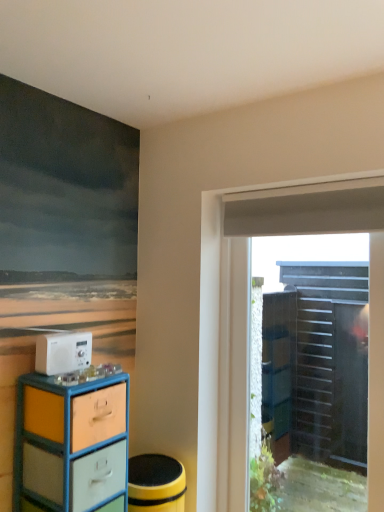
Question: Does white plastic radio at lower left have a larger size compared to matte plastic chest of drawers at left?

Choices:
 (A) no
 (B) yes

Answer: (A)

Question: Does white plastic radio at lower left have a smaller size compared to matte plastic chest of drawers at left?

Choices:
 (A) yes
 (B) no

Answer: (A)

Question: Is the surface of white plastic radio at lower left in direct contact with matte plastic chest of drawers at left?

Choices:
 (A) yes
 (B) no

Answer: (B)

Question: Does white plastic radio at lower left contain matte plastic chest of drawers at left?

Choices:
 (A) yes
 (B) no

Answer: (B)

Question: Is white plastic radio at lower left outside of matte plastic chest of drawers at left?

Choices:
 (A) yes
 (B) no

Answer: (A)

Question: Considering the positions of white plastic radio at lower left and transparent plastic door at right in the image, is white plastic radio at lower left wider or thinner than transparent plastic door at right?

Choices:
 (A) thin
 (B) wide

Answer: (A)

Question: From a real-world perspective, is white plastic radio at lower left positioned above or below transparent plastic door at right?

Choices:
 (A) above
 (B) below

Answer: (A)

Question: Looking at the image, does white plastic radio at lower left seem bigger or smaller compared to transparent plastic door at right?

Choices:
 (A) big
 (B) small

Answer: (B)

Question: Considering their positions, is white plastic radio at lower left located in front of or behind transparent plastic door at right?

Choices:
 (A) behind
 (B) front

Answer: (B)

Question: Considering the positions of matte plastic chest of drawers at left and white plastic radio at lower left in the image, is matte plastic chest of drawers at left bigger or smaller than white plastic radio at lower left?

Choices:
 (A) small
 (B) big

Answer: (B)

Question: From the image's perspective, is matte plastic chest of drawers at left located above or below white plastic radio at lower left?

Choices:
 (A) above
 (B) below

Answer: (B)

Question: Is matte plastic chest of drawers at left inside or outside of white plastic radio at lower left?

Choices:
 (A) outside
 (B) inside

Answer: (A)

Question: Looking at their shapes, would you say matte plastic chest of drawers at left is wider or thinner than white plastic radio at lower left?

Choices:
 (A) wide
 (B) thin

Answer: (A)

Question: In the image, is white plastic radio at lower left on the left side or the right side of matte plastic chest of drawers at left?

Choices:
 (A) left
 (B) right

Answer: (A)

Question: Considering the positions of point (89, 356) and point (76, 466), is point (89, 356) closer or farther from the camera than point (76, 466)?

Choices:
 (A) closer
 (B) farther

Answer: (B)